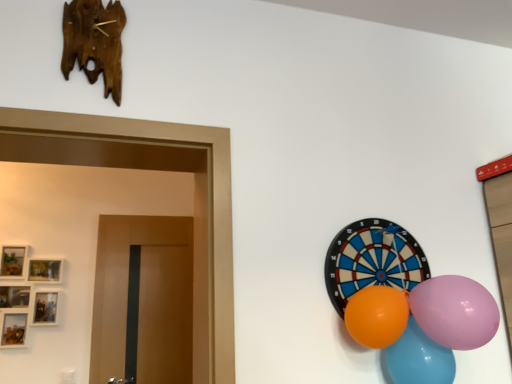
Question: From the image's perspective, is pink glossy balloon at right, which appears as the second balloon when viewed from the right, located above or below orange rubber balloon at right, the third balloon positioned from the right?

Choices:
 (A) above
 (B) below

Answer: (A)

Question: Is point [414, 311] positioned closer to the camera than point [355, 294]?

Choices:
 (A) closer
 (B) farther

Answer: (A)

Question: Which is farther from the rubber balloon at right?

Choices:
 (A) orange rubber balloon at right, the first balloon positioned from the left
 (B) shiny plastic balloons at lower right, acting as the first balloon starting from the right
 (C) pink glossy balloon at right, which is counted as the second balloon, starting from the left

Answer: (B)

Question: Considering the real-world distances, which object is farthest from the rubber balloon at right?

Choices:
 (A) shiny plastic balloons at lower right, the third balloon from the left
 (B) orange rubber balloon at right, the first balloon positioned from the left
 (C) pink glossy balloon at right, which appears as the second balloon when viewed from the right

Answer: (A)